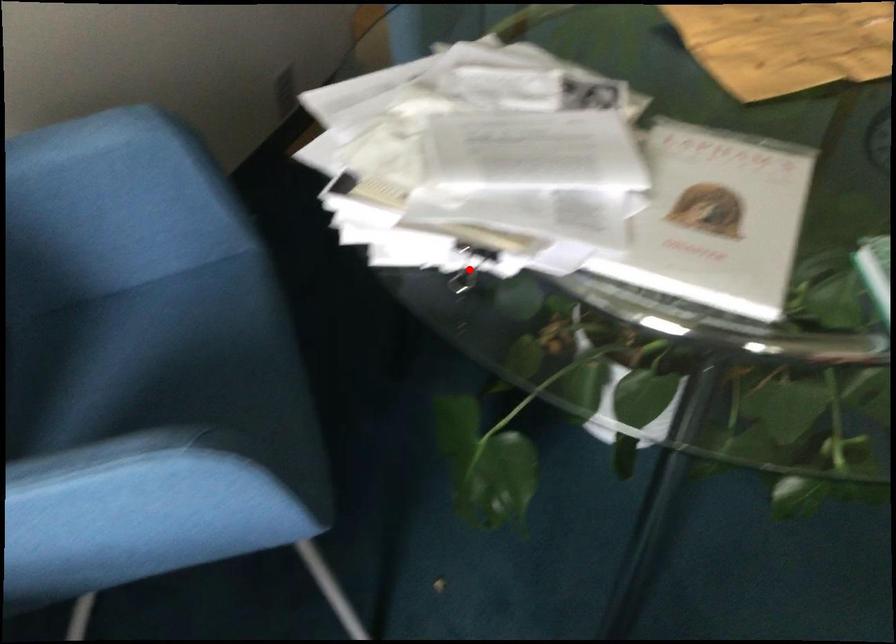
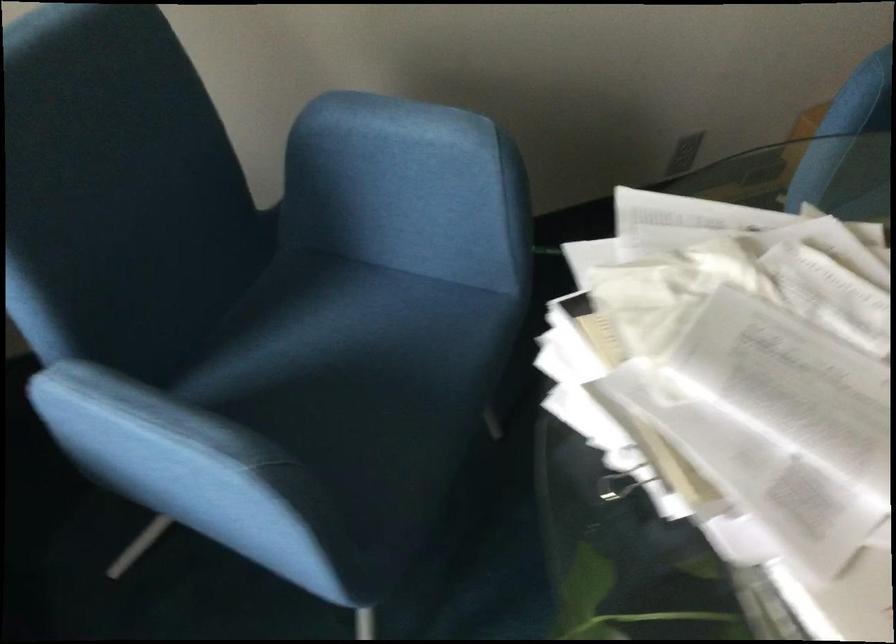
Question: I am providing you with two images of the same scene from different viewpoints. A red point is marked on the first image. Is the red point's position out of view in image 2?

Choices:
 (A) Yes
 (B) No

Answer: (A)